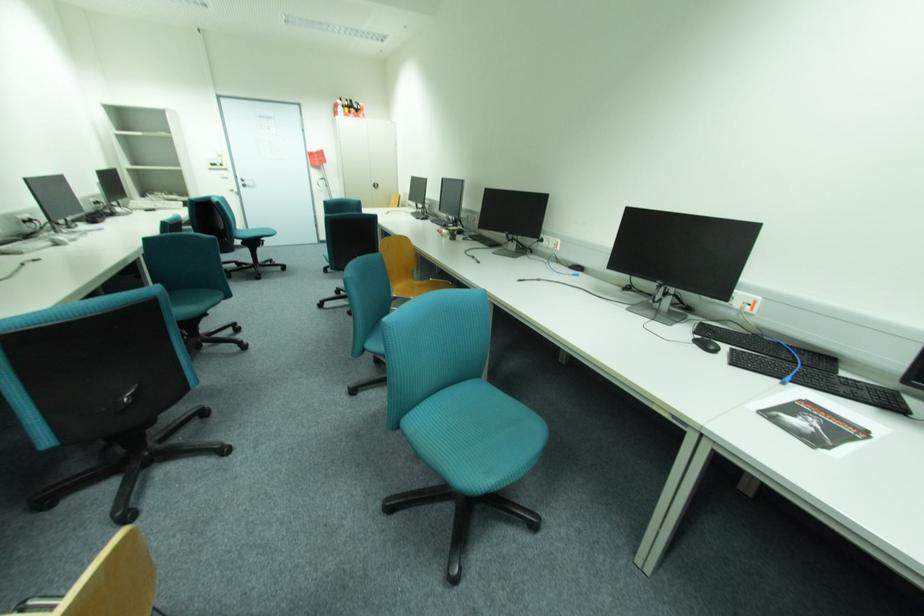
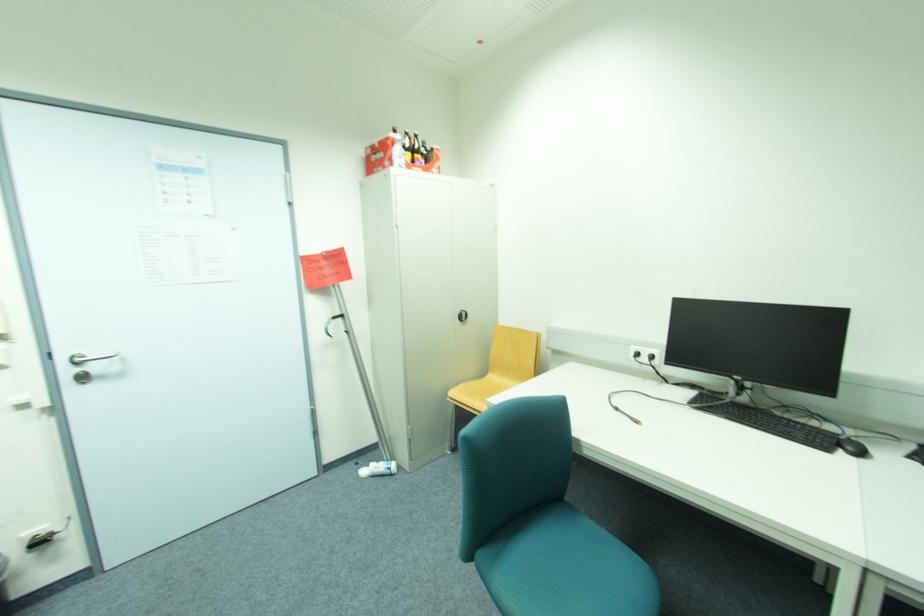
Locate, in the second image, the point that corresponds to (x=426, y=220) in the first image.

(847, 454)